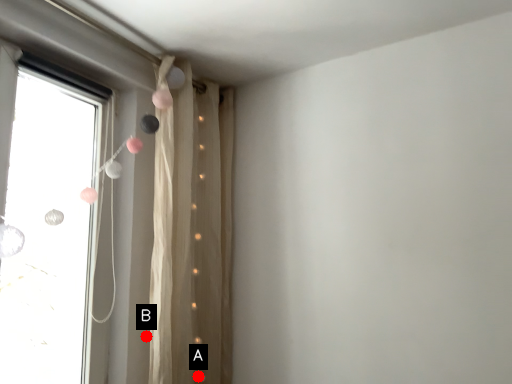
Question: Two points are circled on the image, labeled by A and B beside each circle. Which point is further to the camera?

Choices:
 (A) A is further
 (B) B is further

Answer: (A)